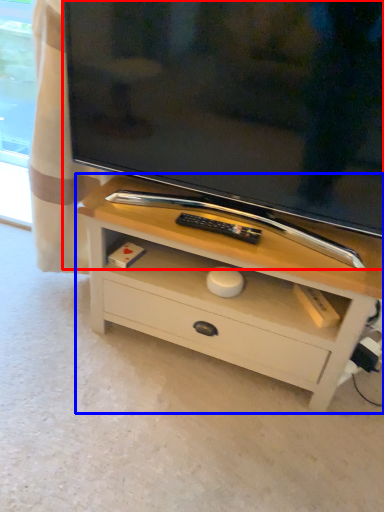
Question: Which point is further to the camera, television (highlighted by a red box) or chest of drawers (highlighted by a blue box)?

Choices:
 (A) television
 (B) chest of drawers

Answer: (B)